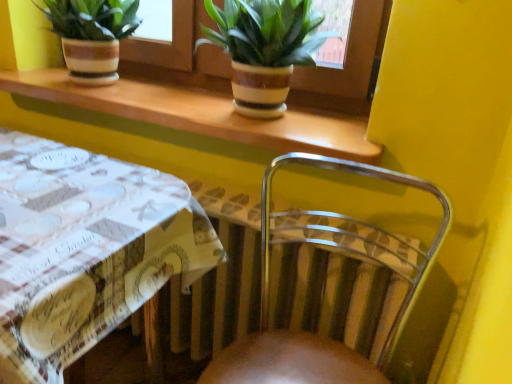
Identify the location of vacant space that's between matte striped pot at upper left, the 1th houseplant when ordered from left to right, and green leafy plant in striped pot at upper center, acting as the second houseplant starting from the left. This screenshot has height=384, width=512. (167, 97).